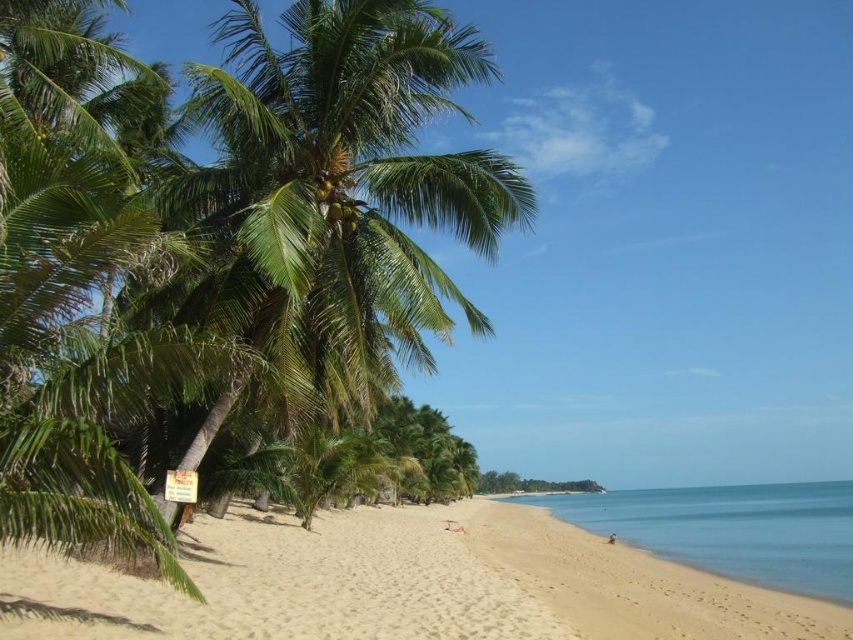
You are standing on the beige sandy beach at center and want to shade yourself under the green leafy coconut tree at left. Is the tree positioned in a way that it can provide shade over the beach area?

The green leafy coconut tree at left is positioned over the beige sandy beach at center, so yes, it can provide shade over the beach area.

You are standing on the beach and want to take a photo of the green leafy coconut tree at left. The camera you have can focus on objects up to 5 meters away. Will the tree be in focus?

The green leafy coconut tree at left is 4.93 meters away from camera, so it will be in focus since it is within the camera focus range of up to 5 meters.